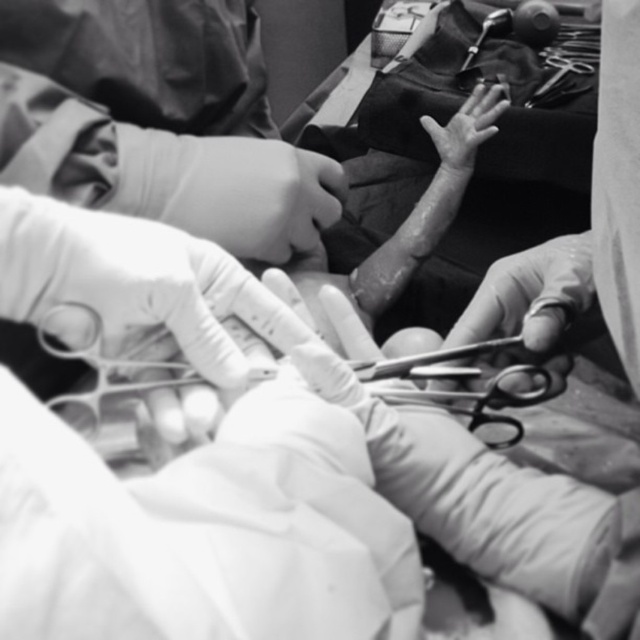
You are a surgical intern observing a procedure. You notice the smooth rubber glove at center and the smooth metal scissors at center. Which object is closer to you?

The smooth rubber glove at center is closer to you because it is positioned further to the viewer than the smooth metal scissors at center.

You are a medical student observing a surgery. You notice the smooth rubber glove at center and the smooth skin hand at center. Which object is positioned lower in the image?

The smooth rubber glove at center is below the smooth skin hand at center, so the smooth rubber glove at center is positioned lower in the image.

You are a medical student observing a surgical procedure. You notice the smooth rubber glove at center. Can you determine its exact position in the image using the coordinate system provided?

The smooth rubber glove at center is located at point (253, 195) in the image coordinate system.